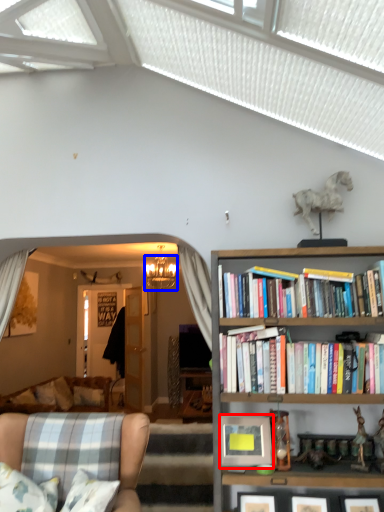
Question: Which object appears closest to the camera in this image, picture frame (highlighted by a red box) or lamp (highlighted by a blue box)?

Choices:
 (A) picture frame
 (B) lamp

Answer: (A)